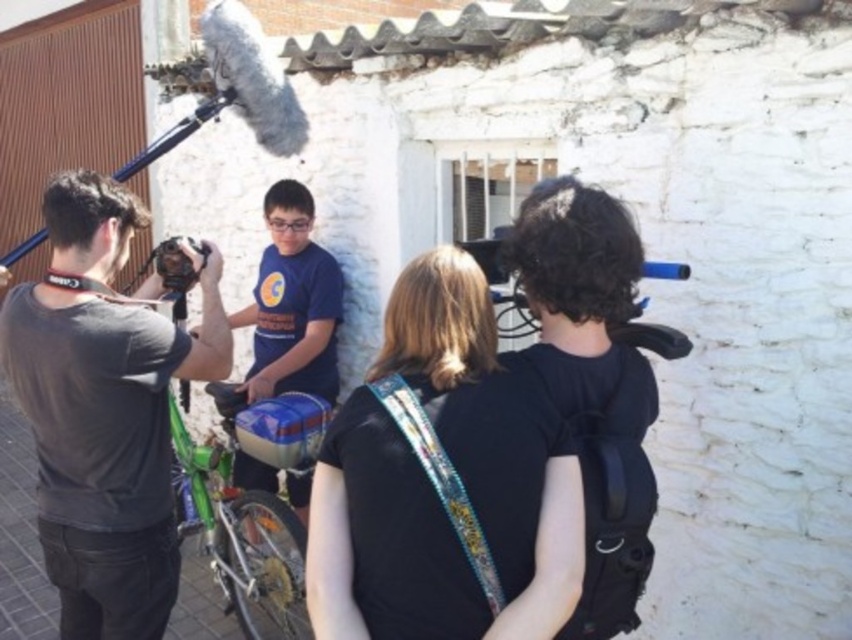
Question: Which point is farther to the camera?

Choices:
 (A) matte black tripod at upper left
 (B) matte black camera at left

Answer: (A)

Question: Does green matte bicycle at center appear under matte black tripod at upper left?

Choices:
 (A) yes
 (B) no

Answer: (A)

Question: Which of the following is the farthest from the observer?

Choices:
 (A) blue t-shirt at center
 (B) green matte bicycle at center
 (C) matte black camera at center
 (D) black fabric backpack at center

Answer: (A)

Question: Where is matte black camera at left located in relation to matte black tripod at upper left in the image?

Choices:
 (A) right
 (B) left

Answer: (B)

Question: Is matte black camera at left below green matte bicycle at center?

Choices:
 (A) yes
 (B) no

Answer: (B)

Question: Which point appears closest to the camera in this image?

Choices:
 (A) (392, 458)
 (B) (18, 257)
 (C) (95, 298)

Answer: (A)